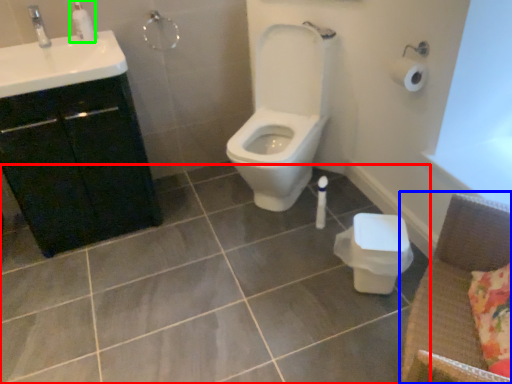
Question: Estimate the real-world distances between objects in this image. Which object is closer to ceramic tile (highlighted by a red box), armchair (highlighted by a blue box) or soap dispenser (highlighted by a green box)?

Choices:
 (A) armchair
 (B) soap dispenser

Answer: (A)